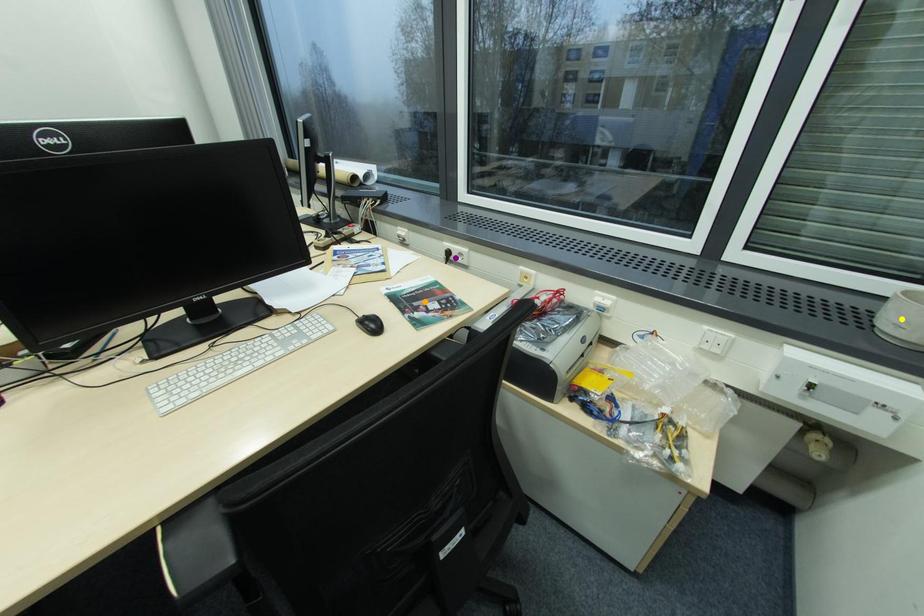
Order these from nearest to farthest:
A) yellow point
B) orange point
C) purple point

1. yellow point
2. orange point
3. purple point